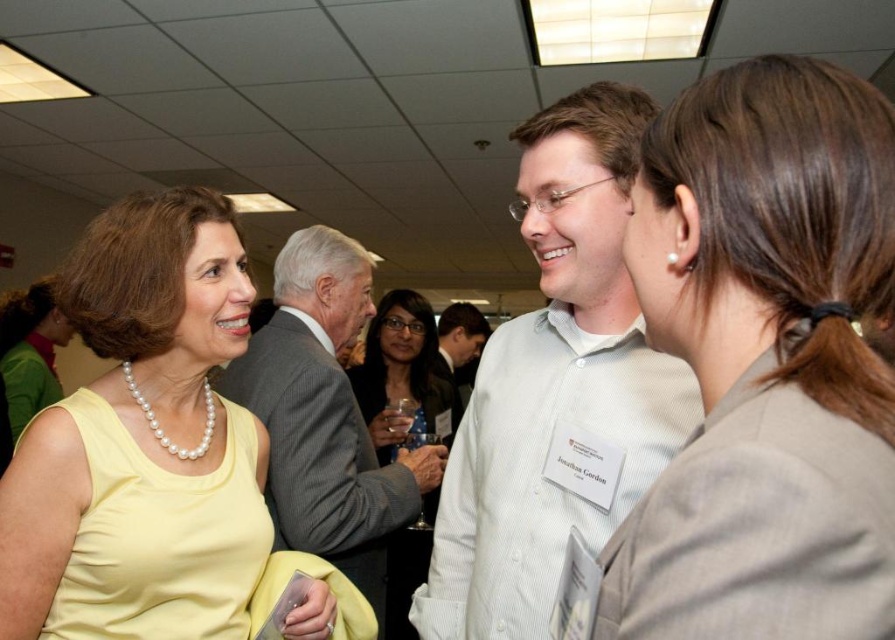
Does white button-down shirt at center have a greater width compared to matte black dress at center?

In fact, white button-down shirt at center might be narrower than matte black dress at center.

Is white button-down shirt at center above matte black dress at center?

Indeed, white button-down shirt at center is positioned over matte black dress at center.

Image resolution: width=895 pixels, height=640 pixels. Find the location of `white button-down shirt at center`. white button-down shirt at center is located at coordinates (556, 387).

Where is `white button-down shirt at center`? This screenshot has height=640, width=895. white button-down shirt at center is located at coordinates (556, 387).

Is brown hair at upper right further to the viewer compared to white button-down shirt at center?

That is False.

Is brown hair at upper right shorter than white button-down shirt at center?

Yes, brown hair at upper right is shorter than white button-down shirt at center.

The image size is (895, 640). What do you see at coordinates (765, 362) in the screenshot?
I see `brown hair at upper right` at bounding box center [765, 362].

I want to click on brown hair at upper right, so click(x=765, y=362).

Is brown hair at upper right to the right of matte black dress at center from the viewer's perspective?

Correct, you'll find brown hair at upper right to the right of matte black dress at center.

Between point (650, 538) and point (424, 429), which one is positioned in front?

Point (650, 538) is more forward.

Where is `brown hair at upper right`? The height and width of the screenshot is (640, 895). brown hair at upper right is located at coordinates (765, 362).